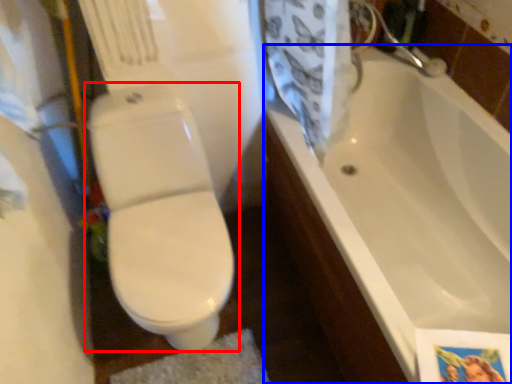
Question: Which object is closer to the camera taking this photo, toilet (highlighted by a red box) or bathtub (highlighted by a blue box)?

Choices:
 (A) toilet
 (B) bathtub

Answer: (B)